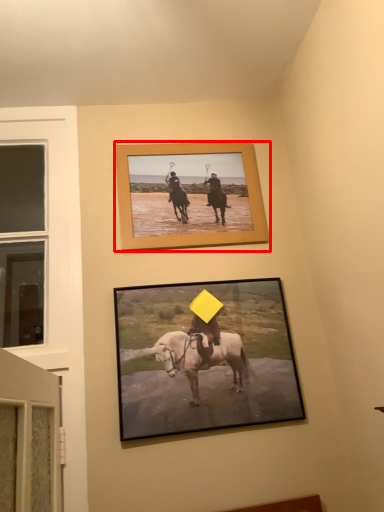
Question: From the image, what is the correct spatial relationship of picture frame (annotated by the red box) in relation to picture frame?

Choices:
 (A) left
 (B) right

Answer: (A)